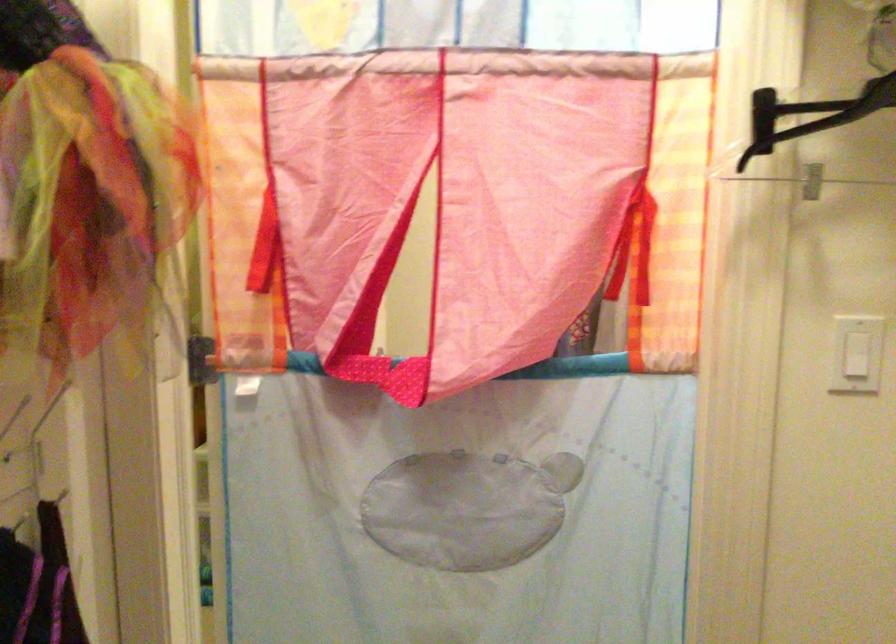
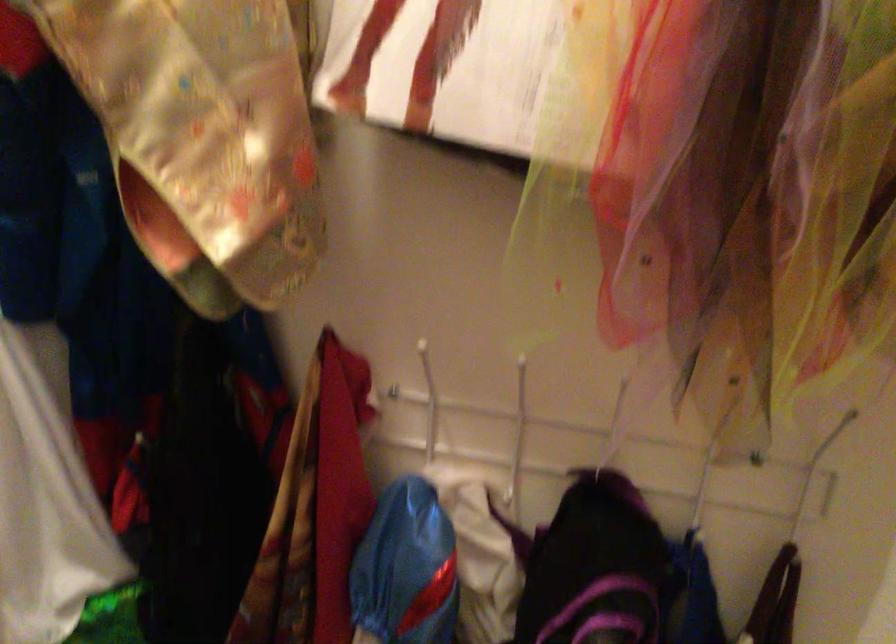
How did the camera likely rotate?

The rotation direction of the camera is left-down.